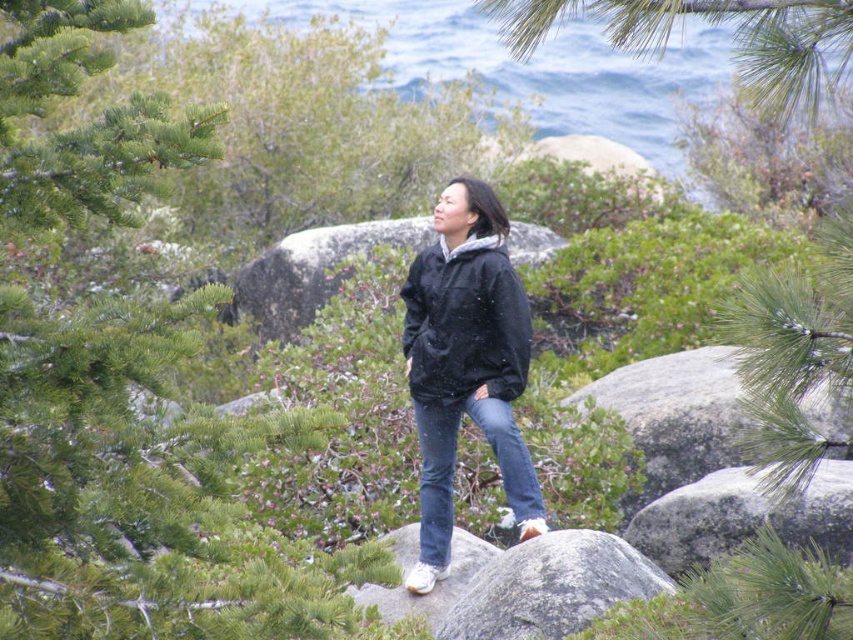
Question: Which point appears farthest from the camera in this image?

Choices:
 (A) (738, 486)
 (B) (300, 276)

Answer: (B)

Question: Does green leafy tree at upper left appear on the left side of gray granite boulder at center-right?

Choices:
 (A) no
 (B) yes

Answer: (B)

Question: Which object is positioned farthest from the gray rough boulder at lower right?

Choices:
 (A) green pine branch at upper center
 (B) blue water at upper center
 (C) matte black jacket at center

Answer: (B)

Question: Which point appears closest to the camera in this image?

Choices:
 (A) (341, 561)
 (B) (486, 308)

Answer: (A)

Question: Observing the image, what is the correct spatial positioning of black matte jacket at center in reference to gray rough boulder at lower right?

Choices:
 (A) left
 (B) right

Answer: (A)

Question: Does green pine branch at upper center lie behind gray smooth boulder at center?

Choices:
 (A) yes
 (B) no

Answer: (B)